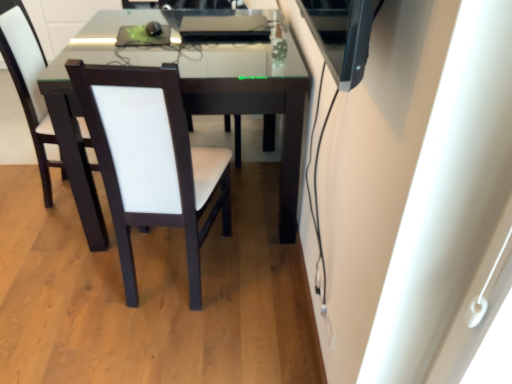
Locate an element on the screen. This screenshot has width=512, height=384. white leather chair at center, which appears as the 1th chair when viewed from the left is located at coordinates (28, 82).

Locate an element on the screen. white leather chair at center, the third chair in the right-to-left sequence is located at coordinates (28, 82).

Which object is closer to the camera, white leather chair at center, which ranks as the 2th chair in right-to-left order, or white leather chair at center, the 1th chair from the right?

white leather chair at center, which ranks as the 2th chair in right-to-left order, is in front.

Is white leather chair at center, which is counted as the 3th chair, starting from the left, surrounded by white leather chair at center, the 2th chair in the left-to-right sequence?

No, white leather chair at center, which is counted as the 3th chair, starting from the left, is not inside white leather chair at center, the 2th chair in the left-to-right sequence.

Are white leather chair at center, which ranks as the 2th chair in right-to-left order, and white leather chair at center, the 1th chair from the right, located far from each other?

No, white leather chair at center, which ranks as the 2th chair in right-to-left order, is not far from white leather chair at center, the 1th chair from the right.

Is point (12, 27) positioned after point (9, 20)?

That is True.

Would you say white leather chair at center, the third chair in the right-to-left sequence, is inside or outside white leather chair at center, the 1th chair from the right?

white leather chair at center, the third chair in the right-to-left sequence, is located inside white leather chair at center, the 1th chair from the right.

From the image's perspective, is white leather chair at center, which appears as the 1th chair when viewed from the left, positioned above or below white leather chair at center, the 1th chair from the right?

Clearly, from the image's perspective, white leather chair at center, which appears as the 1th chair when viewed from the left, is above white leather chair at center, the 1th chair from the right.

From the image's perspective, starting from the white leather chair at center, which appears as the 1th chair when viewed from the left, which chair is the 1st one below? Please provide its 2D coordinates.

[(26, 78)]

Between white leather chair at center, the 2th chair in the left-to-right sequence, and white leather chair at center, the third chair in the right-to-left sequence, which one appears on the right side from the viewer's perspective?

Positioned to the right is white leather chair at center, the 2th chair in the left-to-right sequence.

Is the depth of white leather chair at center, which ranks as the 2th chair in right-to-left order, greater than that of white leather chair at center, the third chair in the right-to-left sequence?

No.

Is there a large distance between white leather chair at center, the 2th chair in the left-to-right sequence, and white leather chair at center, the third chair in the right-to-left sequence?

No, white leather chair at center, the 2th chair in the left-to-right sequence, is not far away from white leather chair at center, the third chair in the right-to-left sequence.

Can you tell me how much white leather chair at center, which ranks as the 2th chair in right-to-left order, and white leather chair at center, the third chair in the right-to-left sequence, differ in facing direction?

The angular difference between white leather chair at center, which ranks as the 2th chair in right-to-left order, and white leather chair at center, the third chair in the right-to-left sequence, is 85.9 degrees.

Which object is positioned more to the right, white leather chair at center, which appears as the 1th chair when viewed from the left, or white leather chair at center, the 2th chair in the left-to-right sequence?

white leather chair at center, the 2th chair in the left-to-right sequence.

Is white leather chair at center, the third chair in the right-to-left sequence, placed right next to white leather chair at center, the 2th chair in the left-to-right sequence?

There is a gap between white leather chair at center, the third chair in the right-to-left sequence, and white leather chair at center, the 2th chair in the left-to-right sequence.

Would you say white leather chair at center, which appears as the 1th chair when viewed from the left, is inside or outside white leather chair at center, the 2th chair in the left-to-right sequence?

white leather chair at center, which appears as the 1th chair when viewed from the left, is not inside white leather chair at center, the 2th chair in the left-to-right sequence, it's outside.

Visually, is white leather chair at center, which is counted as the 3th chair, starting from the left, positioned to the left or to the right of white leather chair at center, the third chair in the right-to-left sequence?

white leather chair at center, which is counted as the 3th chair, starting from the left, is to the right of white leather chair at center, the third chair in the right-to-left sequence.

Considering the points (77, 137) and (68, 112), which point is in front, point (77, 137) or point (68, 112)?

The point (68, 112) is closer to the camera.

What's the angular difference between white leather chair at center, the 1th chair from the right, and white leather chair at center, which appears as the 1th chair when viewed from the left,'s facing directions?

They differ by 177 degrees in their facing directions.

Does white leather chair at center, the 1th chair from the right, turn towards white leather chair at center, which appears as the 1th chair when viewed from the left?

Yes, white leather chair at center, the 1th chair from the right, is facing white leather chair at center, which appears as the 1th chair when viewed from the left.

Considering the relative sizes of white leather chair at center, the 1th chair from the right, and white leather chair at center, the 2th chair in the left-to-right sequence, in the image provided, is white leather chair at center, the 1th chair from the right, smaller than white leather chair at center, the 2th chair in the left-to-right sequence,?

No, white leather chair at center, the 1th chair from the right, is not smaller than white leather chair at center, the 2th chair in the left-to-right sequence.

Which object is further away from the camera, white leather chair at center, which is counted as the 3th chair, starting from the left, or white leather chair at center, the 2th chair in the left-to-right sequence?

white leather chair at center, which is counted as the 3th chair, starting from the left, is more distant.

Find the location of a particular element. The image size is (512, 384). the 1st chair positioned above the white leather chair at center, which is counted as the 3th chair, starting from the left (from a real-world perspective) is located at coordinates (151, 160).

Which is behind, point (37, 145) or point (195, 305)?

Point (37, 145)

Where is `the 1st chair behind the white leather chair at center, which ranks as the 2th chair in right-to-left order, starting your count from the anchor`? Image resolution: width=512 pixels, height=384 pixels. the 1st chair behind the white leather chair at center, which ranks as the 2th chair in right-to-left order, starting your count from the anchor is located at coordinates (26, 78).

From the white leather chair at center, the 1th chair from the right, count the 2nd chair to the left and point to it. Please provide its 2D coordinates.

[(28, 82)]

Which object lies further to the anchor point white leather chair at center, the 2th chair in the left-to-right sequence, white leather chair at center, which appears as the 1th chair when viewed from the left, or white leather chair at center, which is counted as the 3th chair, starting from the left?

Based on the image, white leather chair at center, which appears as the 1th chair when viewed from the left, appears to be further to white leather chair at center, the 2th chair in the left-to-right sequence.

Consider the image. From the image, which object appears to be nearer to white leather chair at center, which is counted as the 3th chair, starting from the left, white leather chair at center, which appears as the 1th chair when viewed from the left, or white leather chair at center, which ranks as the 2th chair in right-to-left order?

white leather chair at center, which appears as the 1th chair when viewed from the left, is positioned closer to the anchor white leather chair at center, which is counted as the 3th chair, starting from the left.

Estimate the real-world distances between objects in this image. Which object is closer to white leather chair at center, which is counted as the 3th chair, starting from the left, white leather chair at center, which ranks as the 2th chair in right-to-left order, or white leather chair at center, which appears as the 1th chair when viewed from the left?

Among the two, white leather chair at center, which appears as the 1th chair when viewed from the left, is located nearer to white leather chair at center, which is counted as the 3th chair, starting from the left.

Considering their positions, is white leather chair at center, which is counted as the 3th chair, starting from the left, positioned closer to white leather chair at center, which ranks as the 2th chair in right-to-left order, than white leather chair at center, the third chair in the right-to-left sequence?

white leather chair at center, which is counted as the 3th chair, starting from the left, is positioned closer to the anchor white leather chair at center, which ranks as the 2th chair in right-to-left order.

Based on their spatial positions, is white leather chair at center, which is counted as the 3th chair, starting from the left, or white leather chair at center, which ranks as the 2th chair in right-to-left order, closer to white leather chair at center, which appears as the 1th chair when viewed from the left?

white leather chair at center, which is counted as the 3th chair, starting from the left, lies closer to white leather chair at center, which appears as the 1th chair when viewed from the left, than the other object.

Estimate the real-world distances between objects in this image. Which object is closer to white leather chair at center, which appears as the 1th chair when viewed from the left, white leather chair at center, which ranks as the 2th chair in right-to-left order, or white leather chair at center, which is counted as the 3th chair, starting from the left?

The object closer to white leather chair at center, which appears as the 1th chair when viewed from the left, is white leather chair at center, which is counted as the 3th chair, starting from the left.

The width and height of the screenshot is (512, 384). In order to click on chair between white leather chair at center, which appears as the 1th chair when viewed from the left, and white leather chair at center, the 1th chair from the right, from left to right in this screenshot , I will do `click(151, 160)`.